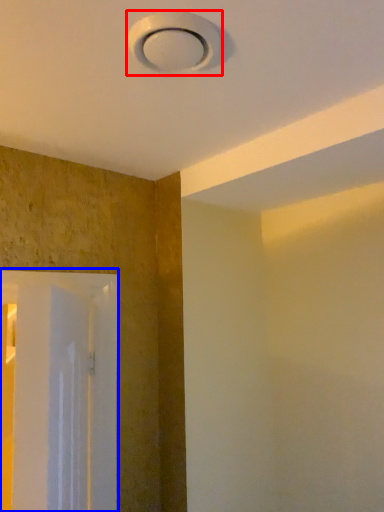
Question: Which object is further to the camera taking this photo, lamp (highlighted by a red box) or screen door (highlighted by a blue box)?

Choices:
 (A) lamp
 (B) screen door

Answer: (B)